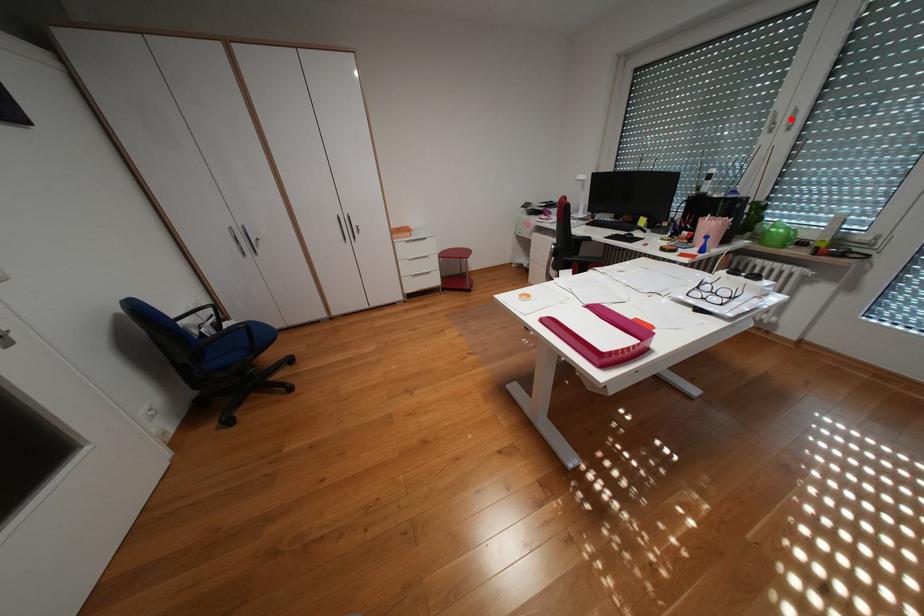
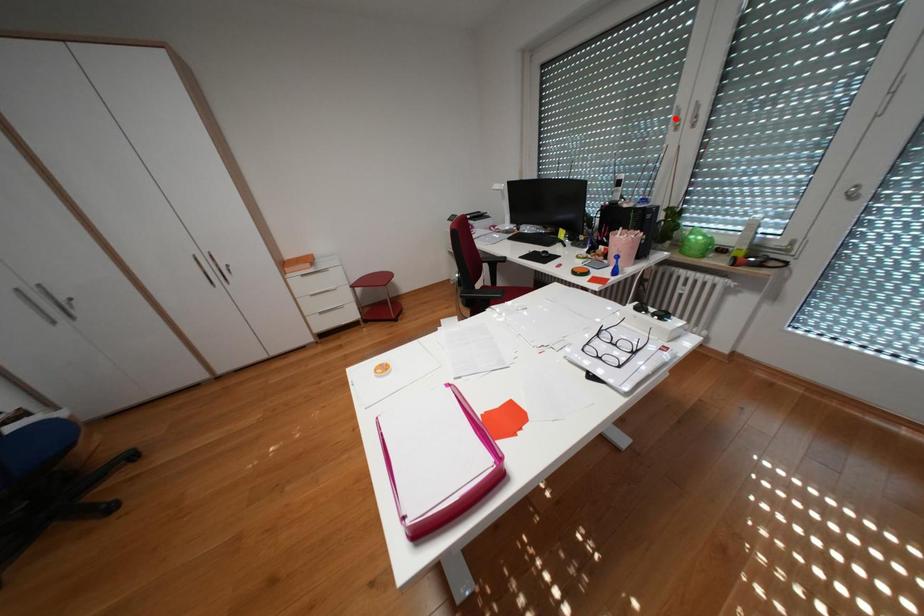
I am providing you with two images of the same scene from different viewpoints. A red point is marked on the first image and another point is marked on the second image. Are the points marked in image1 and image2 representing the same 3D position?

No